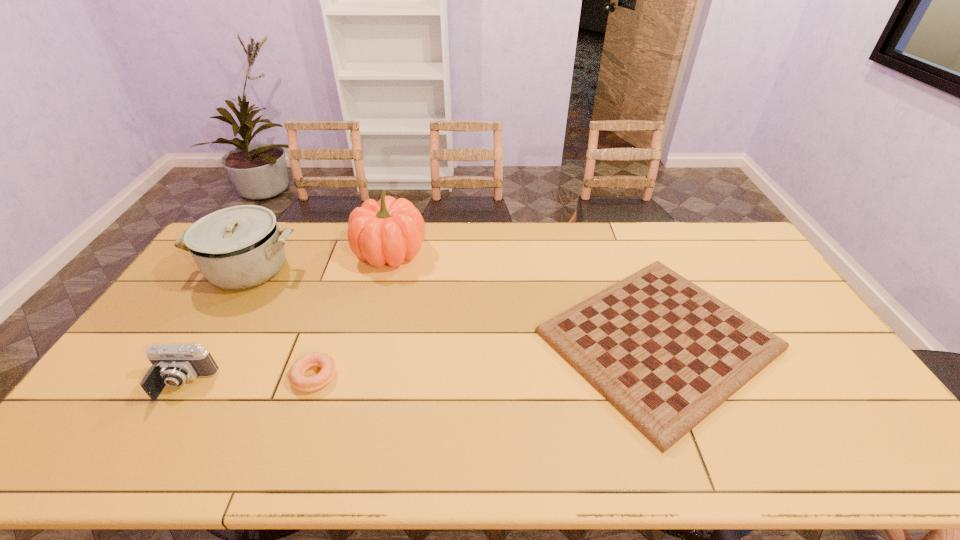
The height and width of the screenshot is (540, 960). I want to click on vacant position at the left edge of the desktop, so (x=213, y=293).

The width and height of the screenshot is (960, 540). In order to click on vacant area at the right edge in this screenshot , I will do `click(854, 397)`.

I want to click on free point between the bagel and the tallest object, so click(352, 314).

Where is `vacant space in between the second tallest object and the camera`? vacant space in between the second tallest object and the camera is located at coordinates (216, 327).

I want to click on vacant point located between the third tallest object and the pumpkin, so click(x=286, y=318).

This screenshot has height=540, width=960. Find the location of `free point between the gameboard and the camera`. free point between the gameboard and the camera is located at coordinates (420, 362).

Where is `empty space that is in between the camera and the fourth shortest object`? This screenshot has height=540, width=960. empty space that is in between the camera and the fourth shortest object is located at coordinates (216, 327).

Find the location of a particular element. vacant area that lies between the second tallest object and the rightmost object is located at coordinates (454, 305).

What are the coordinates of `free area in between the bagel and the pumpkin` in the screenshot? It's located at 352,314.

Image resolution: width=960 pixels, height=540 pixels. In order to click on vacant area between the pumpkin and the bagel in this screenshot , I will do click(352, 314).